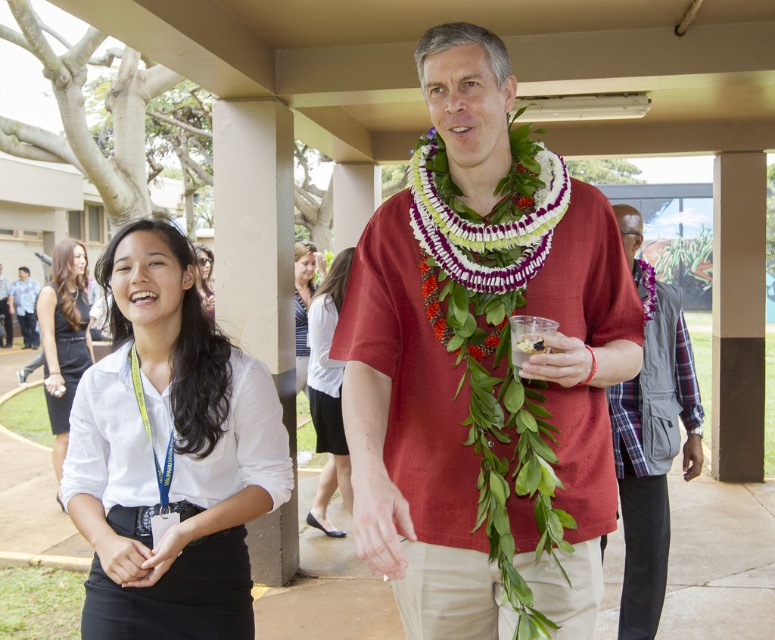
Between white fabric shirt at center and green leafy lei at center, which one has more height?

white fabric shirt at center

What are the coordinates of `white fabric shirt at center` in the screenshot? It's located at (169, 452).

Who is lower down, white cotton blouse at center or matte white shirt at center?

white cotton blouse at center is lower down.

Can you confirm if white cotton blouse at center is smaller than matte white shirt at center?

No.

Where is `white cotton blouse at center`? Image resolution: width=775 pixels, height=640 pixels. white cotton blouse at center is located at coordinates 326,392.

Is striped fabric shirt at center thinner than matte white shirt at center?

Correct, striped fabric shirt at center's width is less than matte white shirt at center's.

Can you confirm if striped fabric shirt at center is bigger than matte white shirt at center?

No, striped fabric shirt at center is not bigger than matte white shirt at center.

Is point (308, 260) positioned in front of point (2, 292)?

Yes, point (308, 260) is in front of point (2, 292).

Locate an element on the screen. This screenshot has height=640, width=775. striped fabric shirt at center is located at coordinates (302, 301).